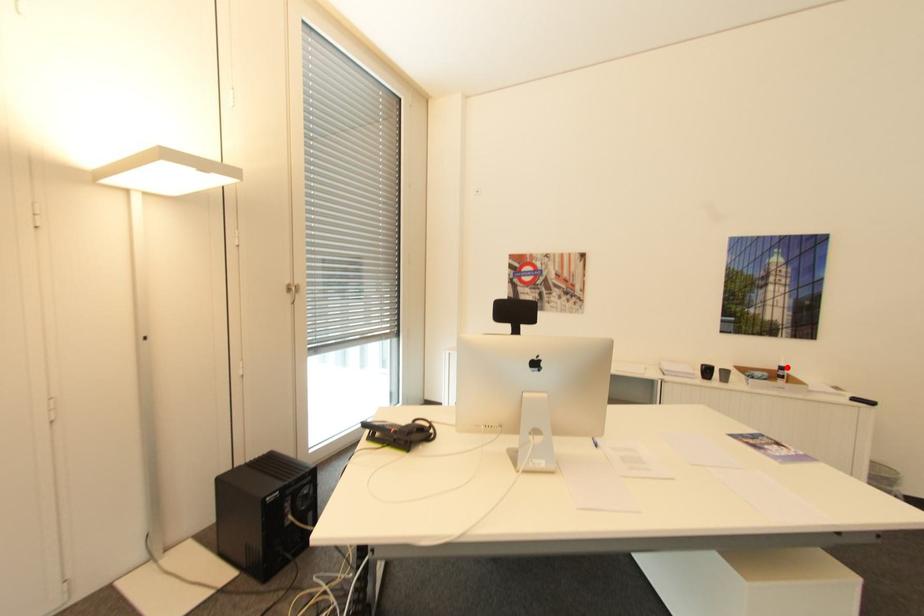
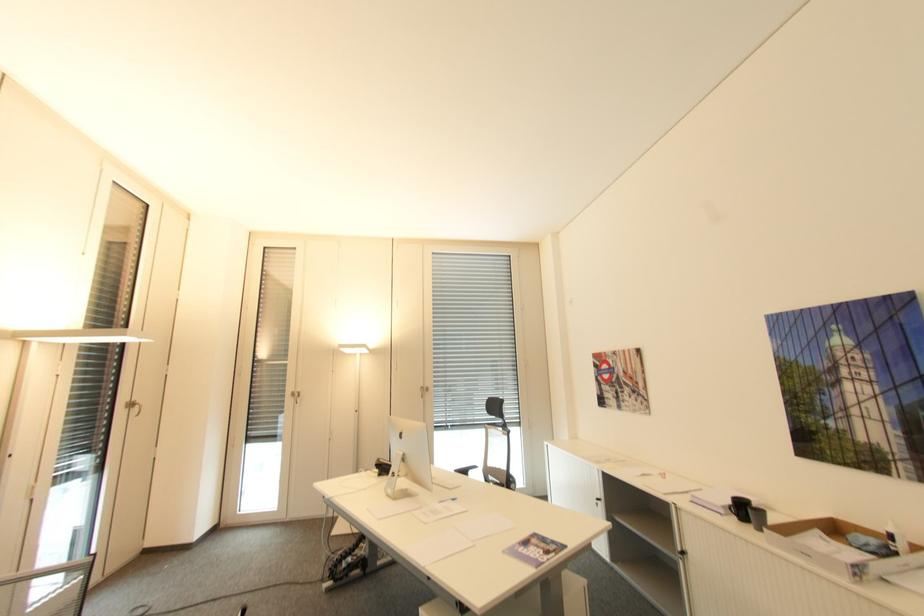
Question: I am providing you with two images of the same scene from different viewpoints. Image1 has a red point marked. In image2, the corresponding 3D location appears at what relative position? Reply with the corresponding letter.

Choices:
 (A) Closer
 (B) Farther

Answer: (A)